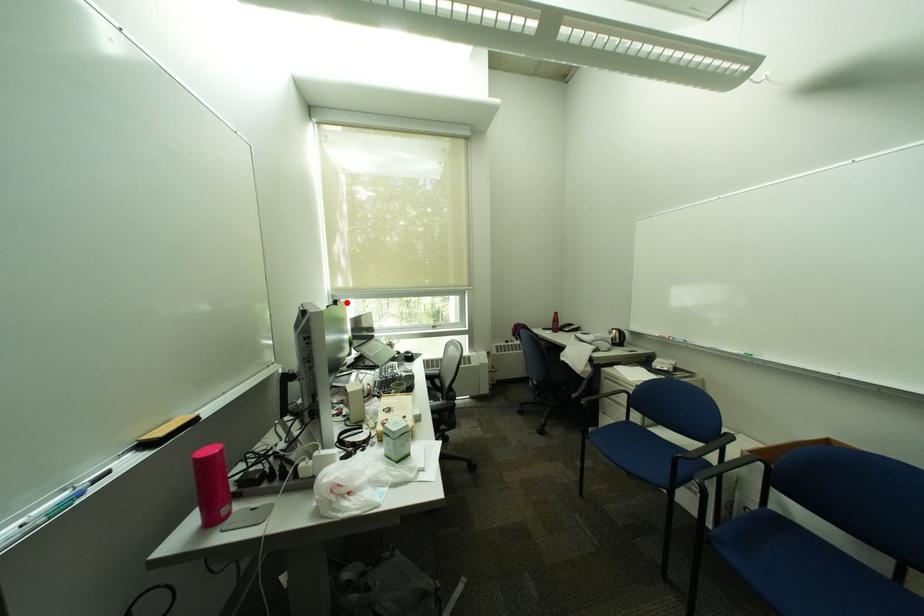
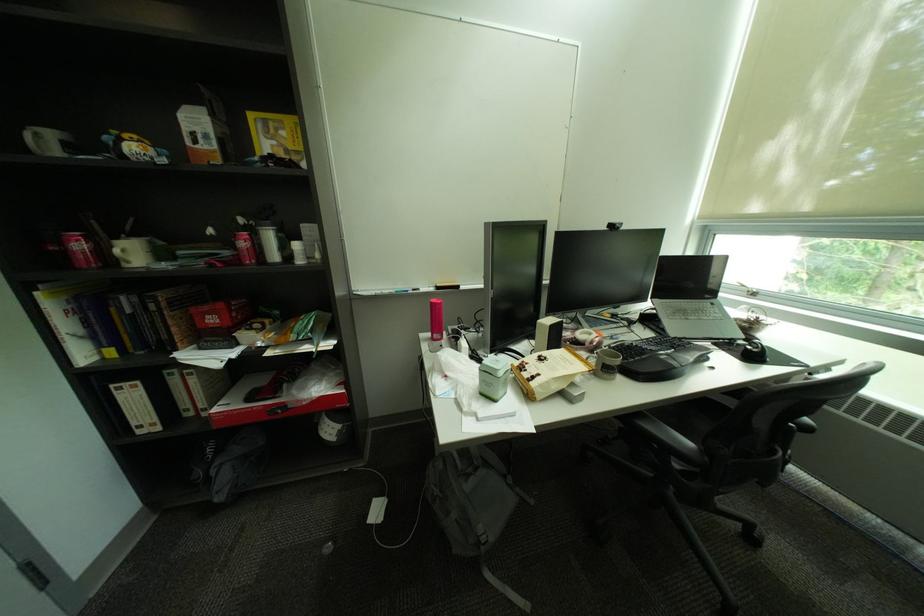
Question: I am providing you with two images of the same scene from different viewpoints. In image1, a red point is highlighted. Considering the same 3D point in image2, which of the following is correct?

Choices:
 (A) It is closer
 (B) It is farther

Answer: (B)